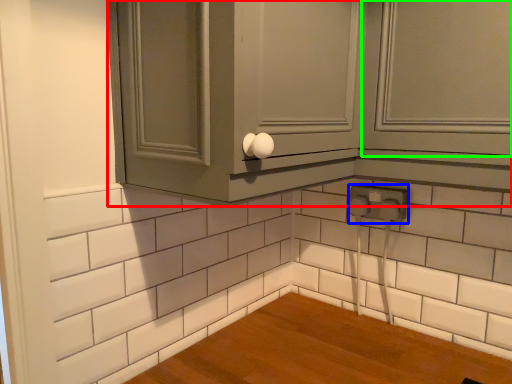
Question: Estimate the real-world distances between objects in this image. Which object is farther from cabinetry (highlighted by a red box), electric outlet (highlighted by a blue box) or window (highlighted by a green box)?

Choices:
 (A) electric outlet
 (B) window

Answer: (A)